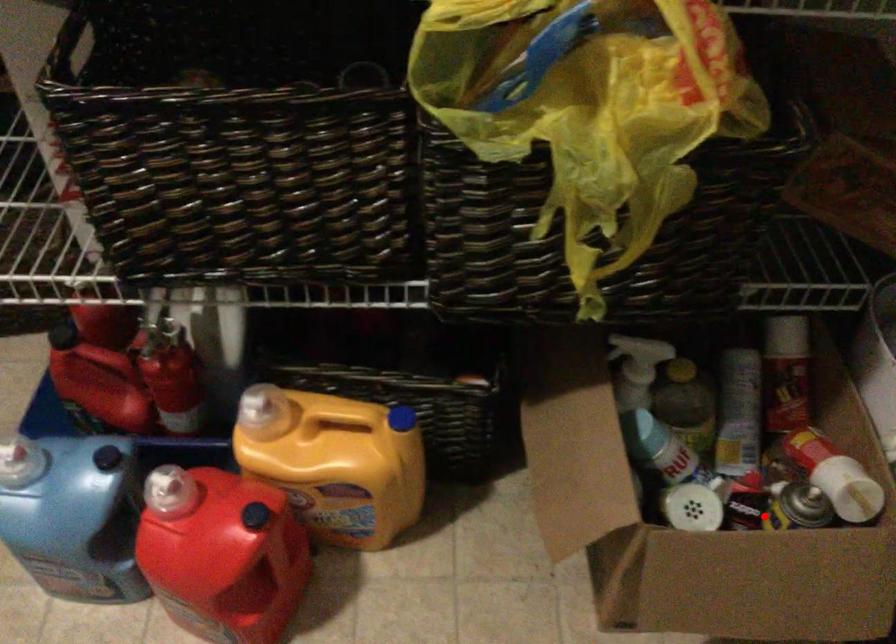
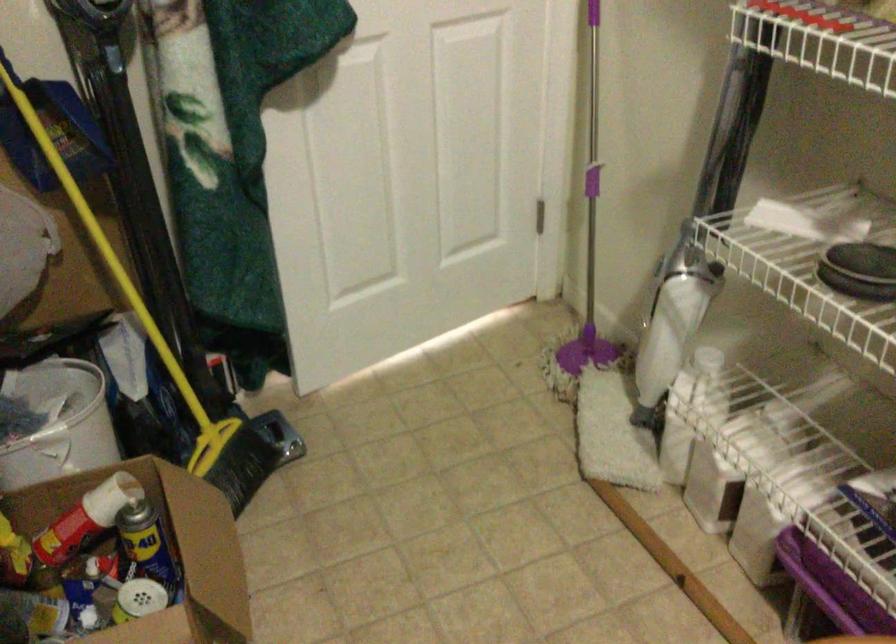
In the second image, find the point that corresponds to the highlighted location in the first image.

(147, 547)